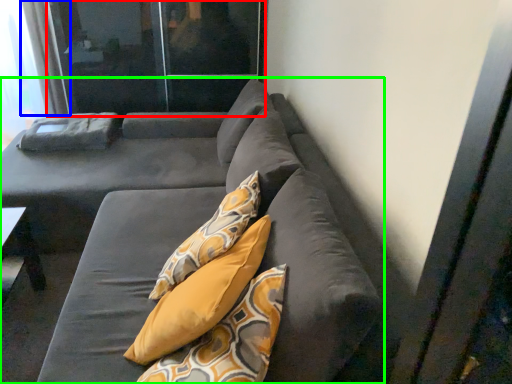
Question: Estimate the real-world distances between objects in this image. Which object is farther from screen door (highlighted by a red box), curtain (highlighted by a blue box) or studio couch (highlighted by a green box)?

Choices:
 (A) curtain
 (B) studio couch

Answer: (B)